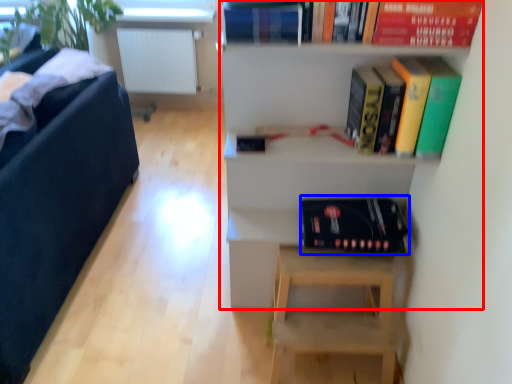
Question: Which object is closer to the camera taking this photo, shelf (highlighted by a red box) or album (highlighted by a blue box)?

Choices:
 (A) shelf
 (B) album

Answer: (A)